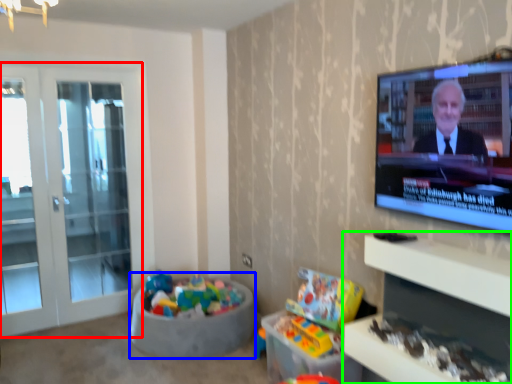
Question: Which object is positioned farthest from screen door (highlighted by a red box)? Select from bean bag chair (highlighted by a blue box) and entertainment center (highlighted by a green box).

Choices:
 (A) bean bag chair
 (B) entertainment center

Answer: (B)